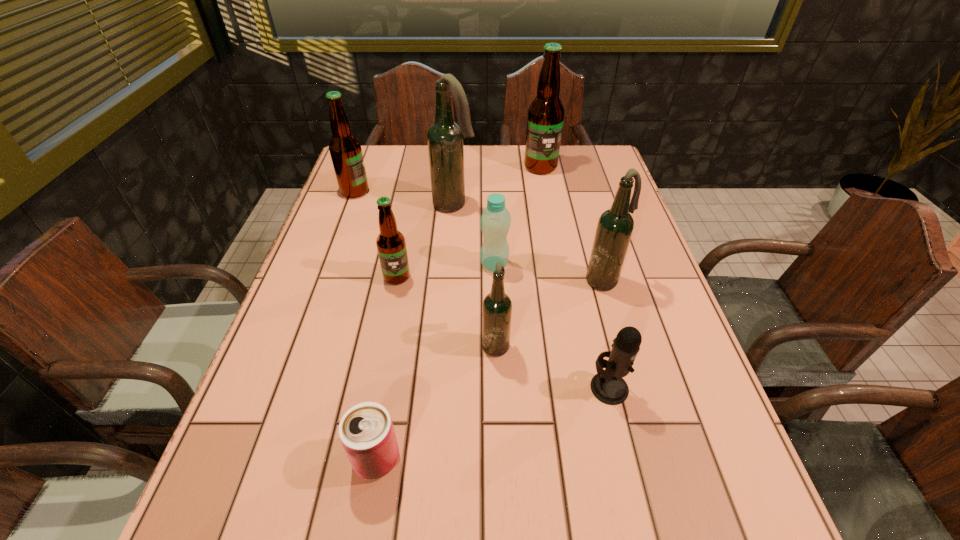
Image resolution: width=960 pixels, height=540 pixels. In the image, there is a desktop. Identify the location of vacant space at the far edge. (514, 160).

Where is `free space at the near edge of the desktop`? free space at the near edge of the desktop is located at coordinates (551, 531).

The width and height of the screenshot is (960, 540). In order to click on vacant point at the left edge in this screenshot , I will do `click(254, 516)`.

In the image, there is a desktop. Identify the location of blank space at the right edge. This screenshot has height=540, width=960. (623, 268).

The image size is (960, 540). In order to click on vacant area at the far right corner of the desktop in this screenshot , I will do `click(592, 182)`.

Where is `free space between the can and the bottle`? free space between the can and the bottle is located at coordinates (436, 362).

Find the location of a particular element. Image resolution: width=960 pixels, height=540 pixels. vacant area that lies between the black microphone and the rightmost dark beer bottle is located at coordinates [x=607, y=334].

Where is `free space between the fifth beer bottle from right to left and the rightmost brown beer bottle`? Image resolution: width=960 pixels, height=540 pixels. free space between the fifth beer bottle from right to left and the rightmost brown beer bottle is located at coordinates (468, 222).

This screenshot has width=960, height=540. Identify the location of vacant space that is in between the nearest object and the smallest brown beer bottle. (387, 368).

In order to click on free spot between the nearest dark beer bottle and the farthest beer bottle in this screenshot , I will do `click(518, 255)`.